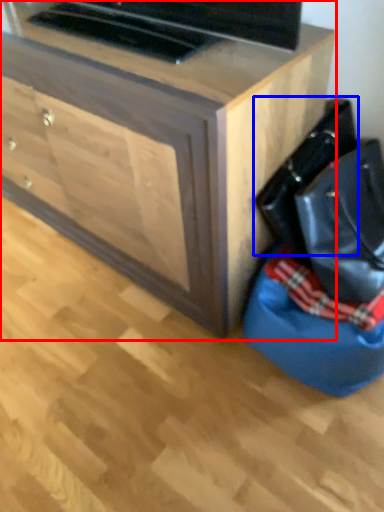
Question: Which point is closer to the camera, chest of drawers (highlighted by a red box) or messenger bag (highlighted by a blue box)?

Choices:
 (A) chest of drawers
 (B) messenger bag

Answer: (A)